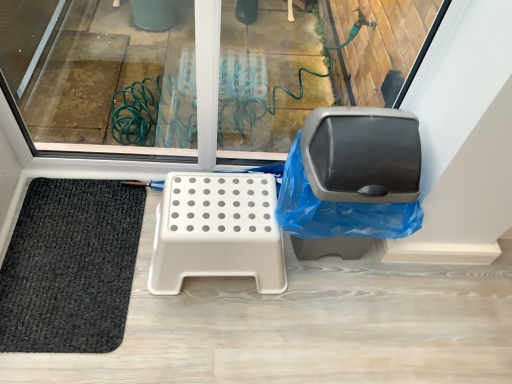
Question: Does black woven mat at lower left have a greater width compared to matte gray swivel chair at right?

Choices:
 (A) yes
 (B) no

Answer: (A)

Question: Considering the relative sizes of black woven mat at lower left and matte gray swivel chair at right in the image provided, is black woven mat at lower left taller than matte gray swivel chair at right?

Choices:
 (A) no
 (B) yes

Answer: (A)

Question: Is black woven mat at lower left facing away from matte gray swivel chair at right?

Choices:
 (A) yes
 (B) no

Answer: (B)

Question: Does black woven mat at lower left come behind matte gray swivel chair at right?

Choices:
 (A) yes
 (B) no

Answer: (A)

Question: From the image's perspective, is black woven mat at lower left located beneath matte gray swivel chair at right?

Choices:
 (A) yes
 (B) no

Answer: (A)

Question: Considering the positions of matte gray swivel chair at right and black woven mat at lower left in the image, is matte gray swivel chair at right wider or thinner than black woven mat at lower left?

Choices:
 (A) wide
 (B) thin

Answer: (B)

Question: In the image, is matte gray swivel chair at right on the left side or the right side of black woven mat at lower left?

Choices:
 (A) left
 (B) right

Answer: (B)

Question: Relative to black woven mat at lower left, is matte gray swivel chair at right in front or behind?

Choices:
 (A) behind
 (B) front

Answer: (B)

Question: From their relative heights in the image, would you say matte gray swivel chair at right is taller or shorter than black woven mat at lower left?

Choices:
 (A) short
 (B) tall

Answer: (B)

Question: From a real-world perspective, relative to black woven mat at lower left, is beige plastic step stool at center vertically above or below?

Choices:
 (A) below
 (B) above

Answer: (B)

Question: From their relative heights in the image, would you say beige plastic step stool at center is taller or shorter than black woven mat at lower left?

Choices:
 (A) tall
 (B) short

Answer: (A)

Question: Considering the positions of point (222, 251) and point (36, 218), is point (222, 251) closer or farther from the camera than point (36, 218)?

Choices:
 (A) farther
 (B) closer

Answer: (B)

Question: Would you say beige plastic step stool at center is inside or outside black woven mat at lower left?

Choices:
 (A) inside
 (B) outside

Answer: (B)

Question: From a real-world perspective, is black woven mat at lower left physically located above or below matte gray swivel chair at right?

Choices:
 (A) below
 (B) above

Answer: (A)

Question: Is black woven mat at lower left inside or outside of matte gray swivel chair at right?

Choices:
 (A) outside
 (B) inside

Answer: (A)